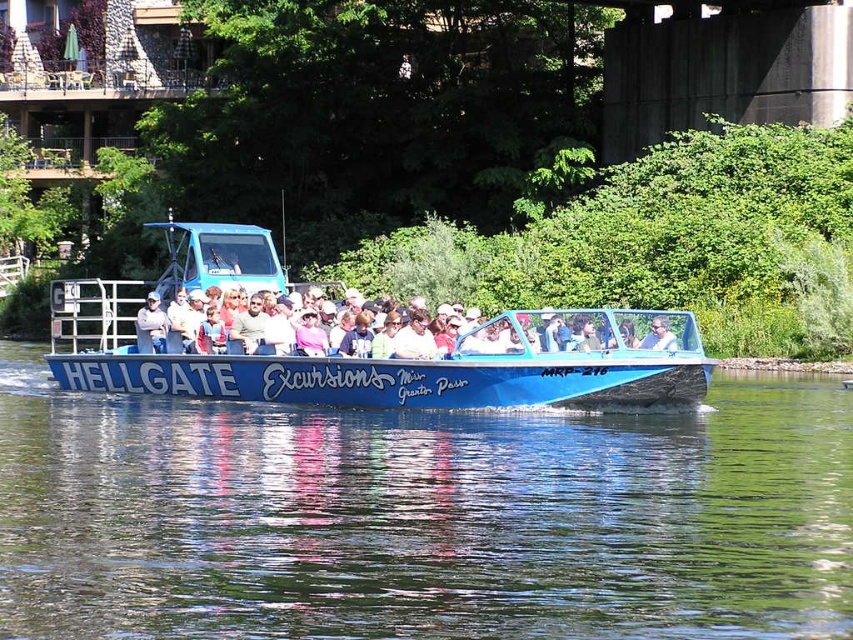
Question: Which point is closer to the camera?

Choices:
 (A) blue glossy water at center
 (B) blue plastic boat at center

Answer: (A)

Question: Among these objects, which one is farthest from the camera?

Choices:
 (A) blue plastic boat at center
 (B) blue glossy water at center

Answer: (A)

Question: Is blue glossy water at center behind blue plastic boat at center?

Choices:
 (A) yes
 (B) no

Answer: (B)

Question: Is blue glossy water at center wider than blue plastic boat at center?

Choices:
 (A) no
 (B) yes

Answer: (B)

Question: Is blue glossy water at center further to the viewer compared to blue plastic boat at center?

Choices:
 (A) no
 (B) yes

Answer: (A)